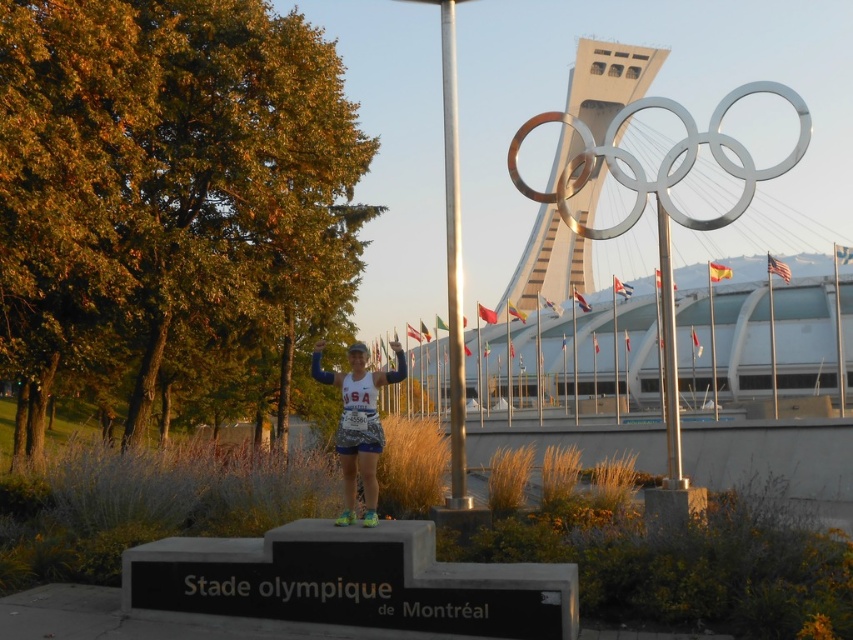
Is camouflage fabric running suit at center positioned behind silver metallic pole at upper center?

No.

Measure the distance between point [381,444] and camera.

Point [381,444] is 8.42 meters away from camera.

Find the location of a particular element. The height and width of the screenshot is (640, 853). camouflage fabric running suit at center is located at coordinates coord(358,424).

Find the location of `camouflage fabric running suit at center`. camouflage fabric running suit at center is located at coordinates (358, 424).

Can you confirm if metallic pole at center is positioned below silver metallic pole at upper center?

No, metallic pole at center is not below silver metallic pole at upper center.

Is metallic pole at center thinner than silver metallic pole at upper center?

Yes, metallic pole at center is thinner than silver metallic pole at upper center.

In order to click on metallic pole at center in this screenshot , I will do `click(453, 259)`.

Does metallic pole at center have a greater width compared to camouflage fabric running suit at center?

No, metallic pole at center is not wider than camouflage fabric running suit at center.

Which is in front, point (450, 214) or point (341, 376)?

Positioned in front is point (341, 376).

Where is `metallic pole at center`? The height and width of the screenshot is (640, 853). metallic pole at center is located at coordinates (453, 259).